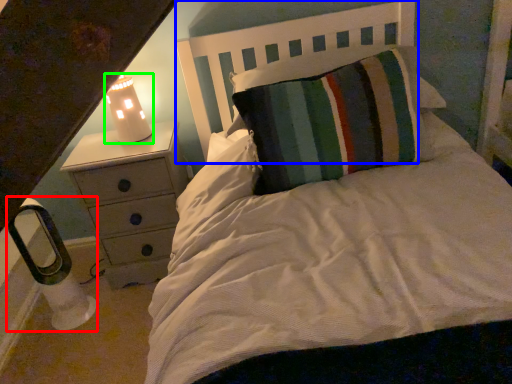
Question: Which object is the closest to the lamp (highlighted by a red box)? Choose among these: headboard (highlighted by a blue box) or lamp (highlighted by a green box).

Choices:
 (A) headboard
 (B) lamp

Answer: (B)